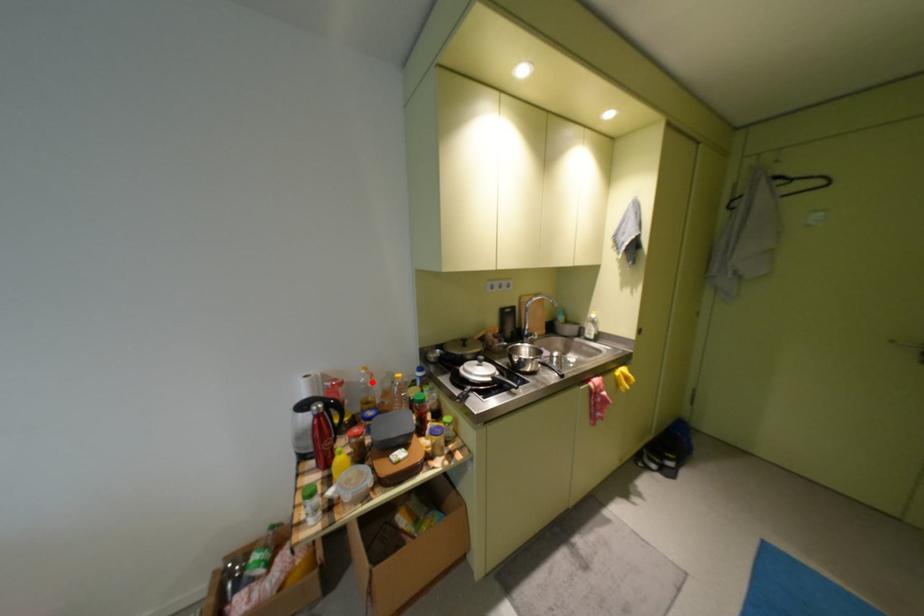
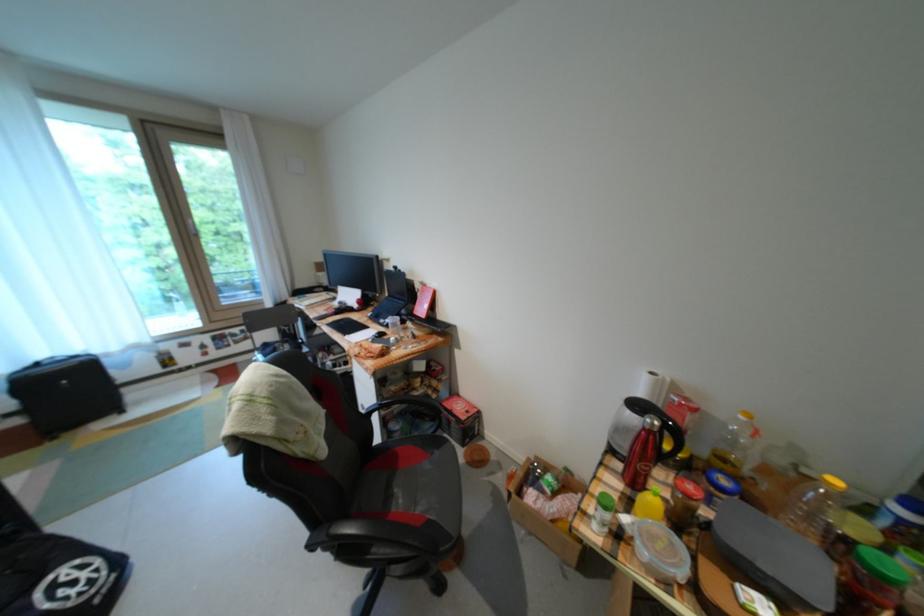
Where in the second image is the point corresponding to the highlighted location from the first image?

(742, 429)